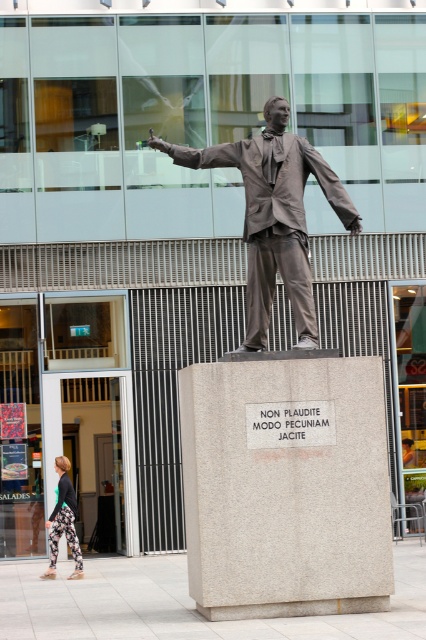
You are a photographer trying to capture both the bronze statue at center and the floral leggings at lower left in a single frame. Which object should you focus on first to ensure both are in the frame without moving the camera?

The bronze statue at center is bigger than floral leggings at lower left, so you should focus on the bronze statue at center first to ensure both are in the frame without moving the camera.

You are a photographer trying to capture a wide shot of the bronze statue at center and the floral leggings at lower left. You need to ensure both subjects are fully visible in the frame. Considering their sizes, which subject should you prioritize positioning closer to the camera to maintain detail in both?

The bronze statue at center is wider than the floral leggings at lower left, so positioning the bronze statue at center closer to the camera will help maintain detail in both subjects.